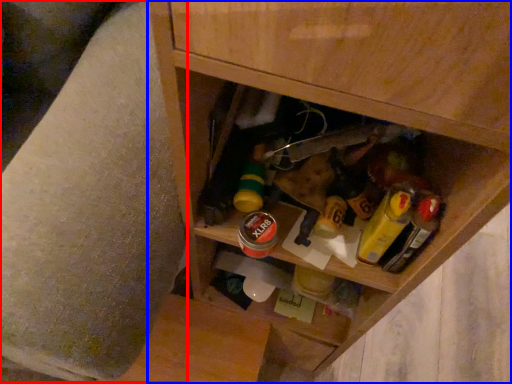
Question: Among these objects, which one is nearest to the camera, swivel chair (highlighted by a red box) or cabinetry (highlighted by a blue box)?

Choices:
 (A) swivel chair
 (B) cabinetry

Answer: (A)